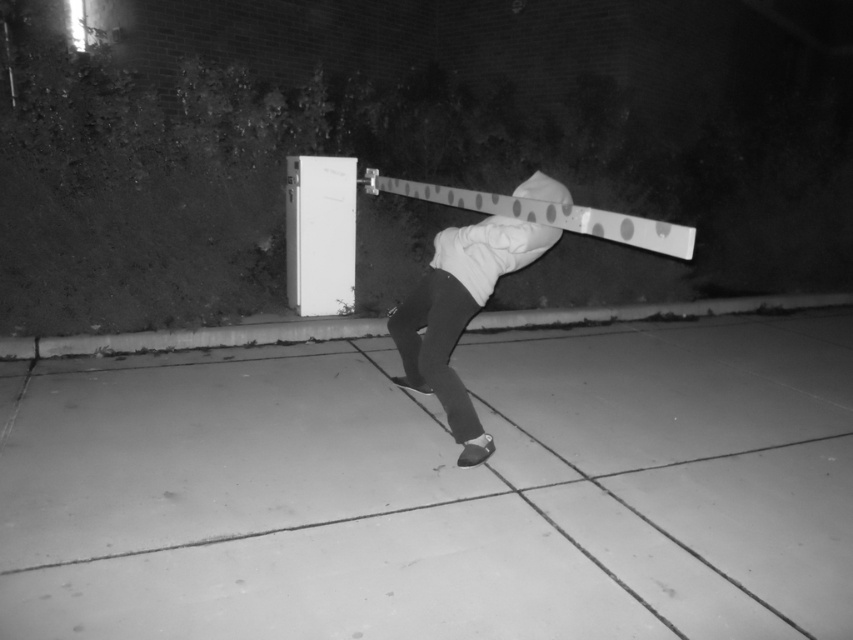
You are a delivery drone trying to land on the smooth concrete pavement at center. The landing pad must be at least 1 meter in diameter. Can you land safely based on the coordinates provided?

The smooth concrete pavement at center is located at coordinates point (440,490). However, the provided information does not specify the size of the pavement, so it is uncertain if it meets the 1 meter diameter requirement for safe landing.

You are a delivery drone flying above the scene. You need to land at the point marked as point (440, 490). Based on the scene description, is this landing spot suitable for a drone?

The point (440, 490) is on smooth concrete pavement at center, which provides a stable and flat surface suitable for drone landing.